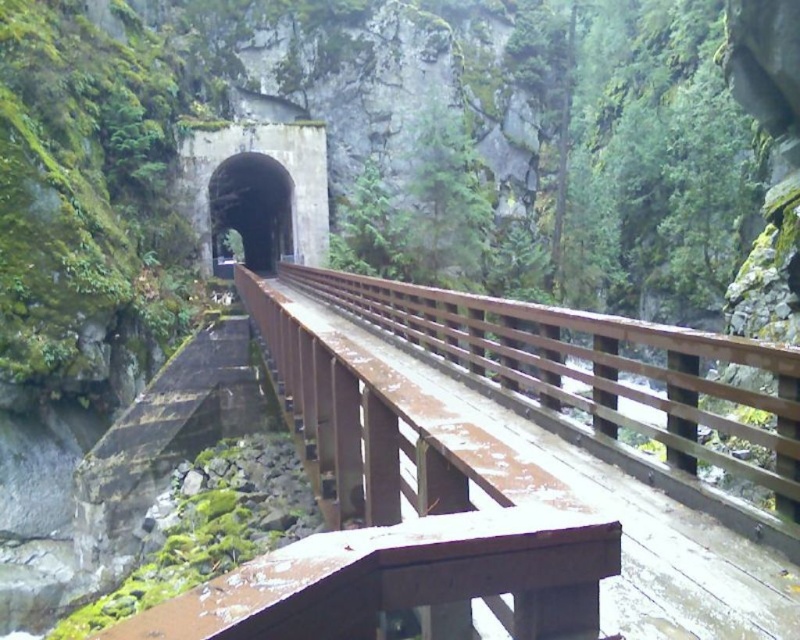
Can you confirm if rusty wood bridge at center is positioned above black concrete tunnel at center?

No.

Does point (308, 380) come closer to viewer compared to point (222, 179)?

Yes, it is in front of point (222, 179).

This screenshot has height=640, width=800. I want to click on rusty wood bridge at center, so click(x=522, y=449).

Is concrete tunnel at center shorter than black concrete tunnel at center?

Yes.

Is point (206, 209) positioned after point (249, 154)?

No, it is in front of (249, 154).

Where is `concrete tunnel at center`? concrete tunnel at center is located at coordinates (270, 157).

Is rusty wood bridge at center shorter than concrete tunnel at center?

In fact, rusty wood bridge at center may be taller than concrete tunnel at center.

Is point (496, 474) farther from viewer compared to point (204, 269)?

No.

The height and width of the screenshot is (640, 800). Identify the location of rusty wood bridge at center. (522, 449).